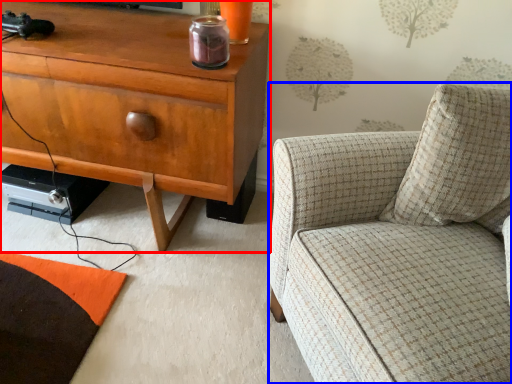
Question: Which of the following is the farthest to the observer, cabinetry (highlighted by a red box) or chair (highlighted by a blue box)?

Choices:
 (A) cabinetry
 (B) chair

Answer: (A)